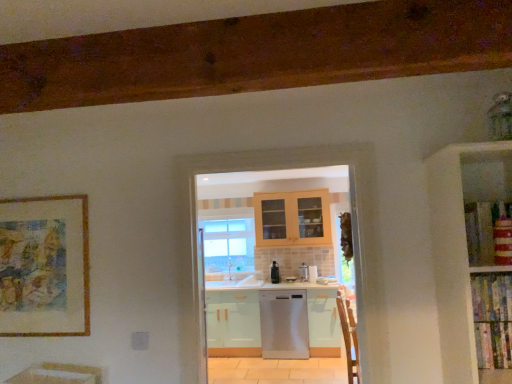
Question: Is point (215, 253) closer or farther from the camera than point (266, 314)?

Choices:
 (A) farther
 (B) closer

Answer: (A)

Question: From their relative heights in the image, would you say clear glass window at center is taller or shorter than satin silver dishwasher at center?

Choices:
 (A) tall
 (B) short

Answer: (A)

Question: Which object is the closest to the gold-framed artwork at left?

Choices:
 (A) wooden armchair at right
 (B) satin black dishwasher at center
 (C) clear glass window at center
 (D) satin silver dishwasher at center
 (E) satin silver dishwasher at center

Answer: (A)

Question: Based on their relative distances, which object is farther from the satin silver dishwasher at center?

Choices:
 (A) satin black dishwasher at center
 (B) clear glass window at center
 (C) gold-framed artwork at left
 (D) satin silver dishwasher at center
 (E) wooden armchair at right

Answer: (C)